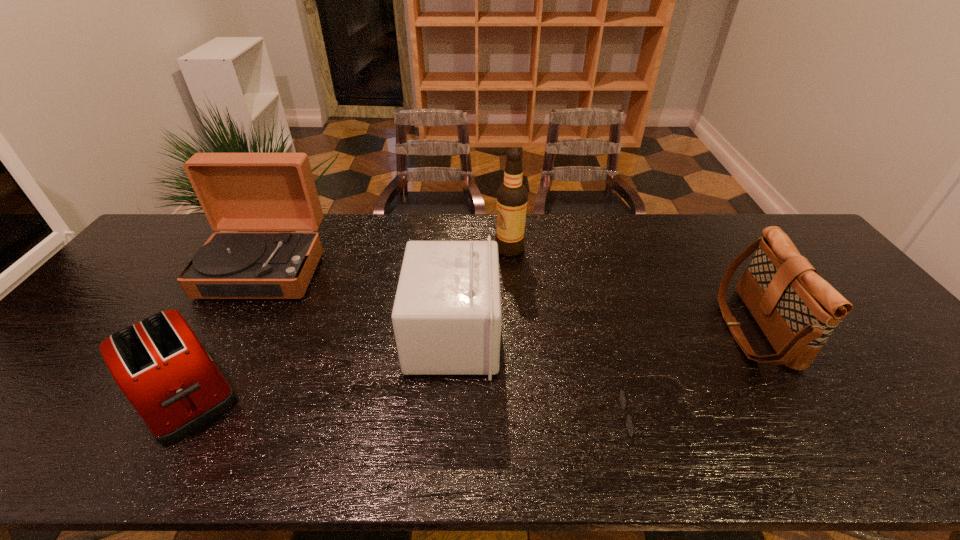
At what (x,y) coordinates should I click in order to perform the action: click on vacant region located 0.250m on the face of the phonograph record. Please return your answer as a coordinate pair (x, y). Looking at the image, I should click on (204, 375).

Locate an element on the screen. free location located on the front-facing side of the third object from left to right is located at coordinates (566, 336).

Where is `free space located on the front-facing side of the rightmost object`? The image size is (960, 540). free space located on the front-facing side of the rightmost object is located at coordinates (667, 328).

Identify the location of free space located 0.140m on the front-facing side of the rightmost object. The height and width of the screenshot is (540, 960). (674, 328).

At what (x,y) coordinates should I click in order to perform the action: click on vacant space situated on the front-facing side of the rightmost object. Please return your answer as a coordinate pair (x, y). Looking at the image, I should click on tap(685, 328).

I want to click on free region located on the right of the second shortest object, so click(281, 392).

You are a GUI agent. You are given a task and a screenshot of the screen. Output one action in this format:
    pyautogui.click(x=<x>, y=<y>)
    Task: Click on the blank space located 0.120m on the front-facing side of the second object from right to left
    
    Given the screenshot: What is the action you would take?
    pos(568,418)

Locate an element on the screen. vacant position located 0.130m on the front-facing side of the second object from right to left is located at coordinates (564, 418).

This screenshot has width=960, height=540. What are the coordinates of `vacant space located 0.380m on the front-facing side of the second object from right to left` in the screenshot? It's located at (451, 418).

Locate an element on the screen. This screenshot has width=960, height=540. alcohol located in the far edge section of the desktop is located at coordinates (512, 196).